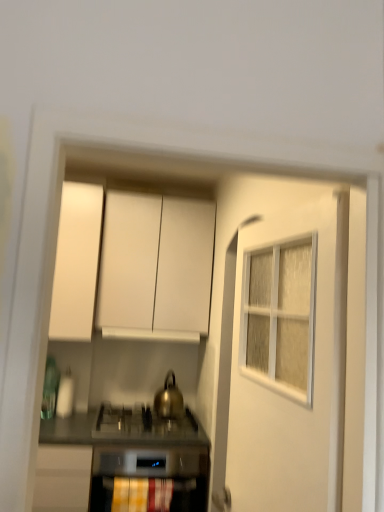
Question: Is white matte cabinet at upper left, positioned as the first cabinetry in left-to-right order, smaller than white matte cabinet at upper center, the second cabinetry when ordered from left to right?

Choices:
 (A) yes
 (B) no

Answer: (A)

Question: Is white matte cabinet at upper left, the 2th cabinetry in the right-to-left sequence, facing away from white matte cabinet at upper center, the second cabinetry when ordered from left to right?

Choices:
 (A) no
 (B) yes

Answer: (A)

Question: Does white matte cabinet at upper left, the 2th cabinetry in the right-to-left sequence, have a larger size compared to white matte cabinet at upper center, arranged as the 1th cabinetry when viewed from the right?

Choices:
 (A) yes
 (B) no

Answer: (B)

Question: From the image's perspective, does white matte cabinet at upper left, positioned as the first cabinetry in left-to-right order, appear lower than white matte cabinet at upper center, the second cabinetry when ordered from left to right?

Choices:
 (A) no
 (B) yes

Answer: (A)

Question: Is white matte cabinet at upper left, the 2th cabinetry in the right-to-left sequence, shorter than white matte cabinet at upper center, the second cabinetry when ordered from left to right?

Choices:
 (A) no
 (B) yes

Answer: (A)

Question: From a real-world perspective, is white matte cabinet at upper left, positioned as the first cabinetry in left-to-right order, located higher than white matte cabinet at upper center, arranged as the 1th cabinetry when viewed from the right?

Choices:
 (A) no
 (B) yes

Answer: (A)

Question: Is white matte cabinet at upper center, arranged as the 1th cabinetry when viewed from the right, oriented away from white matte vent at center?

Choices:
 (A) yes
 (B) no

Answer: (B)

Question: Is white matte cabinet at upper center, the second cabinetry when ordered from left to right, wider than white matte vent at center?

Choices:
 (A) no
 (B) yes

Answer: (B)

Question: From a real-world perspective, is white matte cabinet at upper center, arranged as the 1th cabinetry when viewed from the right, below white matte vent at center?

Choices:
 (A) yes
 (B) no

Answer: (B)

Question: Is white matte cabinet at upper center, the second cabinetry when ordered from left to right, thinner than white matte vent at center?

Choices:
 (A) yes
 (B) no

Answer: (B)

Question: Does white matte cabinet at upper center, arranged as the 1th cabinetry when viewed from the right, have a lesser height compared to white matte vent at center?

Choices:
 (A) yes
 (B) no

Answer: (B)

Question: Can we say white matte cabinet at upper center, arranged as the 1th cabinetry when viewed from the right, lies outside white matte vent at center?

Choices:
 (A) yes
 (B) no

Answer: (A)

Question: Does gold metallic kettle at center have a smaller size compared to metallic stainless steel countertop at center?

Choices:
 (A) no
 (B) yes

Answer: (B)